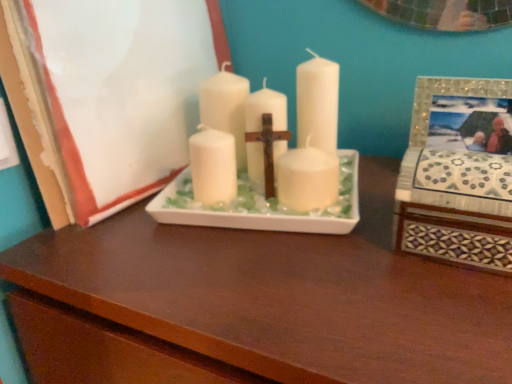
The image size is (512, 384). In order to click on free space in front of white matte candle at center in this screenshot , I will do `click(283, 284)`.